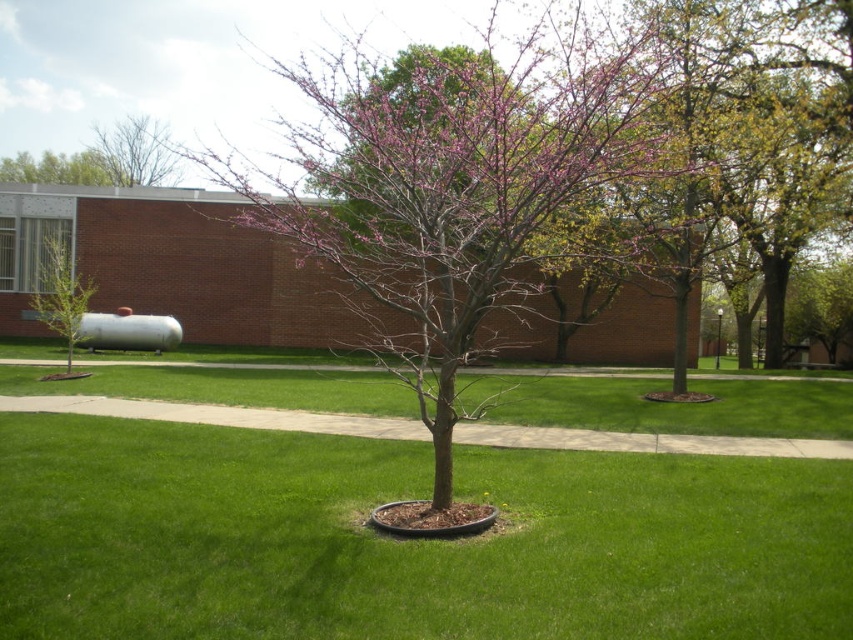
Question: Which point is farther to the camera?

Choices:
 (A) green leafy tree at left
 (B) bare branches at upper left

Answer: (B)

Question: Where is purple-barked tree at center located in relation to bare branches at upper left in the image?

Choices:
 (A) right
 (B) left

Answer: (A)

Question: Is purple-barked tree at center to the left of green leafy tree at left from the viewer's perspective?

Choices:
 (A) no
 (B) yes

Answer: (A)

Question: From the image, what is the correct spatial relationship of bare branches at upper left in relation to green leafy tree at left?

Choices:
 (A) below
 (B) above

Answer: (B)

Question: Which object appears farthest from the camera in this image?

Choices:
 (A) purple-barked tree at center
 (B) bare branches at upper left
 (C) green leafy tree at left

Answer: (B)

Question: Which of the following is the closest to the observer?

Choices:
 (A) purple-barked tree at center
 (B) bare branches at upper left
 (C) green leafy tree at left

Answer: (A)